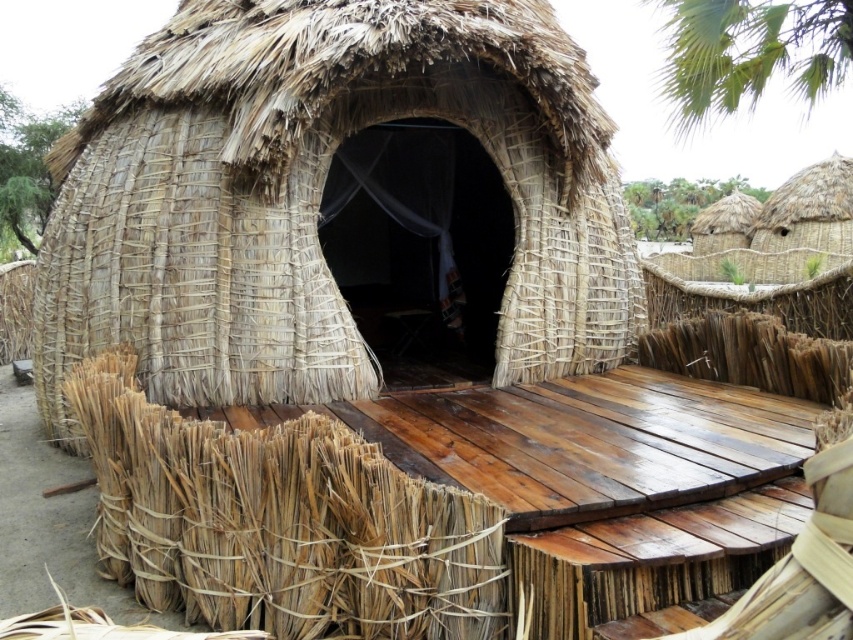
Question: Is natural straw hut at center closer to the viewer compared to green leafy palm tree at upper right?

Choices:
 (A) yes
 (B) no

Answer: (A)

Question: Is brown woven reed at center closer to the viewer compared to natural straw hut at upper right?

Choices:
 (A) yes
 (B) no

Answer: (A)

Question: Is natural straw hut at center to the left of brown woven reed at center from the viewer's perspective?

Choices:
 (A) no
 (B) yes

Answer: (B)

Question: Which is farther from the natural straw hut at center?

Choices:
 (A) brown woven reed at center
 (B) natural straw hut at upper right

Answer: (B)

Question: Which object is farther from the camera taking this photo?

Choices:
 (A) brown woven reed at center
 (B) natural straw hut at upper right
 (C) green leafy palm tree at upper right

Answer: (C)

Question: Which is farther from the natural straw hut at center?

Choices:
 (A) brown woven reed at center
 (B) green leafy palm tree at upper right

Answer: (B)